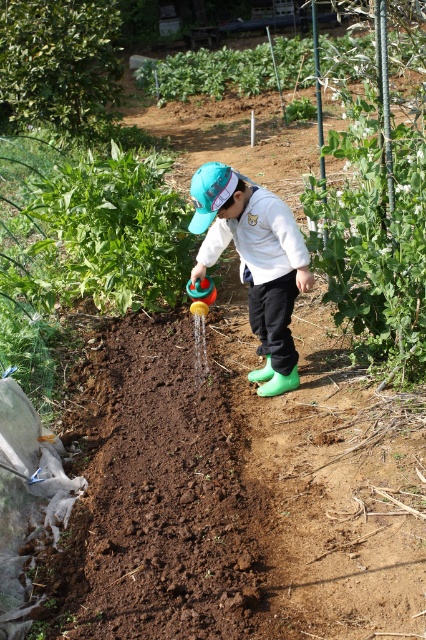
Question: Among these objects, which one is nearest to the camera?

Choices:
 (A) rubber boots at center
 (B) green leafy plant at upper center
 (C) green leafy plant at right

Answer: (A)

Question: Is green leafy plant at right thinner than green leafy plant at upper center?

Choices:
 (A) yes
 (B) no

Answer: (A)

Question: Does rubber boots at center come in front of green leafy plant at upper center?

Choices:
 (A) no
 (B) yes

Answer: (B)

Question: Which object is the farthest from the green leafy plant at upper center?

Choices:
 (A) rubber boots at center
 (B) green leafy plant at right

Answer: (A)

Question: Where is green leafy plant at right located in relation to rubber boots at center in the image?

Choices:
 (A) below
 (B) above

Answer: (B)

Question: Which is farther from the green leafy plant at right?

Choices:
 (A) rubber boots at center
 (B) green leafy plant at upper center

Answer: (B)